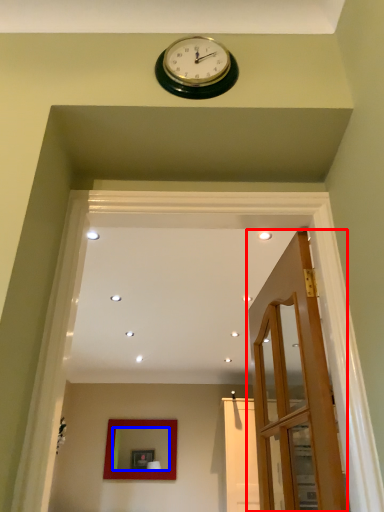
Question: Which object appears farthest to the camera in this image, door (highlighted by a red box) or mirror (highlighted by a blue box)?

Choices:
 (A) door
 (B) mirror

Answer: (B)